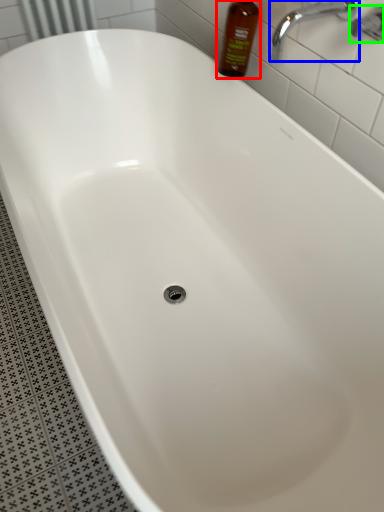
Question: Considering the real-world distances, which object is closest to bottle (highlighted by a red box)? tap (highlighted by a blue box) or plumbing fixture (highlighted by a green box).

Choices:
 (A) tap
 (B) plumbing fixture

Answer: (A)